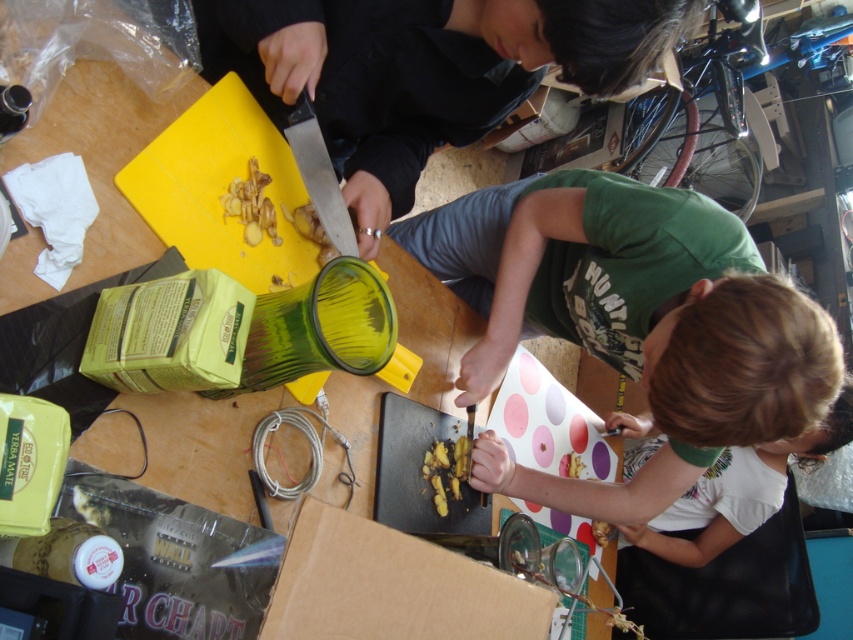
Question: Which point is farther from the camera taking this photo?

Choices:
 (A) (624, 67)
 (B) (572, 465)
 (C) (225, 192)
 (D) (440, 456)

Answer: (B)

Question: Which object appears farthest from the camera in this image?

Choices:
 (A) brown crumbly food at lower center
 (B) green fabric shirt at upper center

Answer: (A)

Question: Which object is positioned farthest from the yellow rubbery food at lower center?

Choices:
 (A) yellow translucent food at lower center
 (B) brown crumbly food at lower center
 (C) green fabric shirt at upper center
 (D) yellow rubbery ginger at upper center

Answer: (D)

Question: Does yellow translucent food at lower center lie in front of brown crumbly food at lower center?

Choices:
 (A) no
 (B) yes

Answer: (B)

Question: Does yellow rubbery ginger at upper center have a smaller size compared to brown crumbly food at lower center?

Choices:
 (A) yes
 (B) no

Answer: (B)

Question: In this image, where is yellow translucent food at lower center located relative to yellow rubbery food at lower center?

Choices:
 (A) below
 (B) above

Answer: (B)